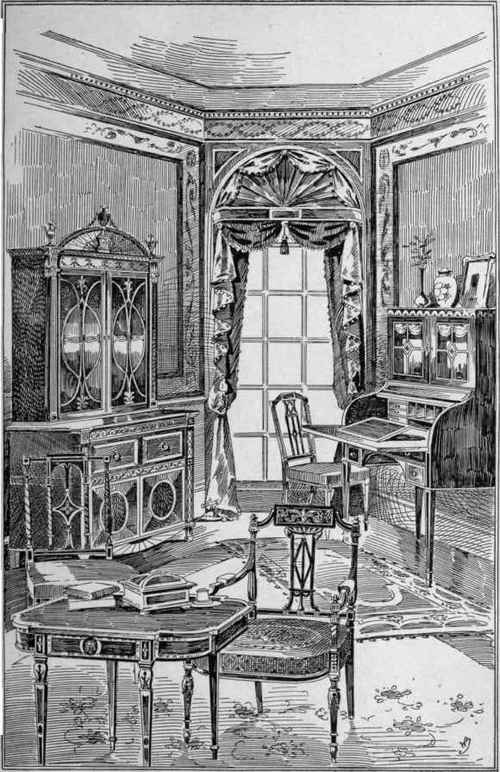
What are the coordinates of `place to sit` in the screenshot? It's located at (273, 655), (322, 469).